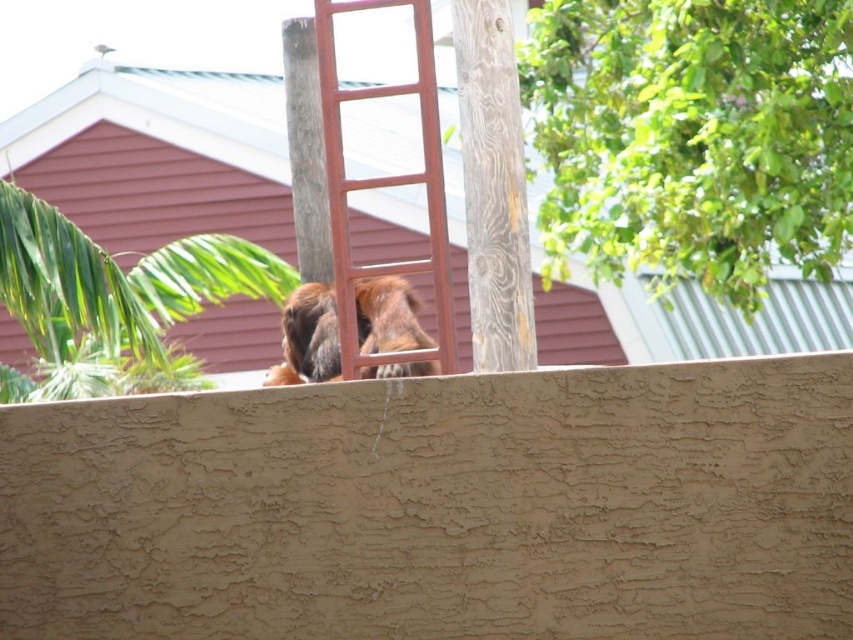
Can you confirm if green leafy tree at upper left is shorter than brown wooden ladder at center?

Indeed, green leafy tree at upper left has a lesser height compared to brown wooden ladder at center.

Does green leafy tree at upper left appear on the left side of brown wooden ladder at center?

Yes, green leafy tree at upper left is to the left of brown wooden ladder at center.

Where is `green leafy tree at upper left`? green leafy tree at upper left is located at coordinates (113, 301).

Where is `green leafy tree at upper left`? The height and width of the screenshot is (640, 853). green leafy tree at upper left is located at coordinates (113, 301).

Is brown wooden ladder at center to the right of brown furry dog at center from the viewer's perspective?

Correct, you'll find brown wooden ladder at center to the right of brown furry dog at center.

Based on the photo, can you confirm if brown wooden ladder at center is positioned to the left of brown furry dog at center?

Incorrect, brown wooden ladder at center is not on the left side of brown furry dog at center.

Identify the location of brown wooden ladder at center. (384, 180).

Can you confirm if green leafy tree at upper left is smaller than weathered wood pole at center?

No.

Which is below, green leafy tree at upper left or weathered wood pole at center?

green leafy tree at upper left is below.

Image resolution: width=853 pixels, height=640 pixels. Describe the element at coordinates (113, 301) in the screenshot. I see `green leafy tree at upper left` at that location.

Where is `green leafy tree at upper left`? green leafy tree at upper left is located at coordinates (113, 301).